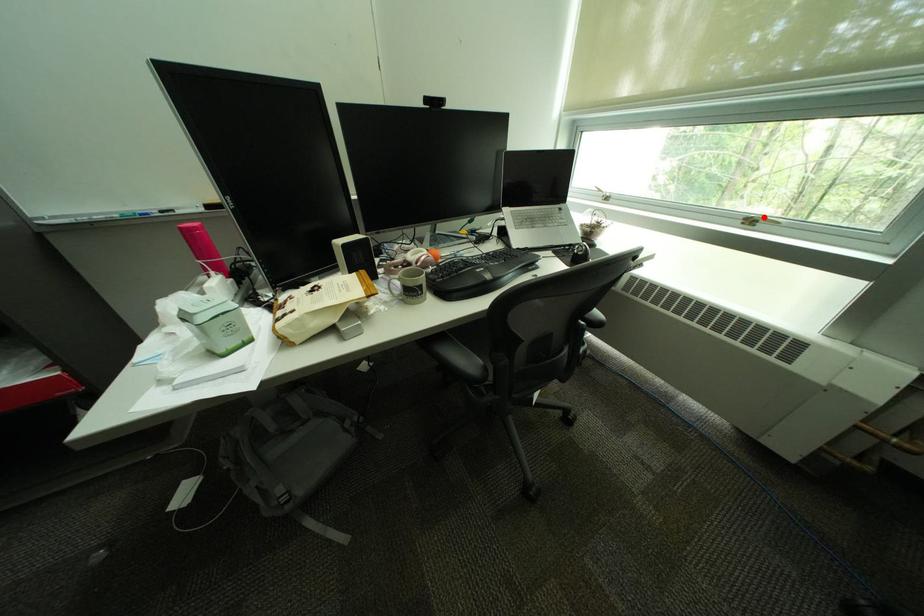
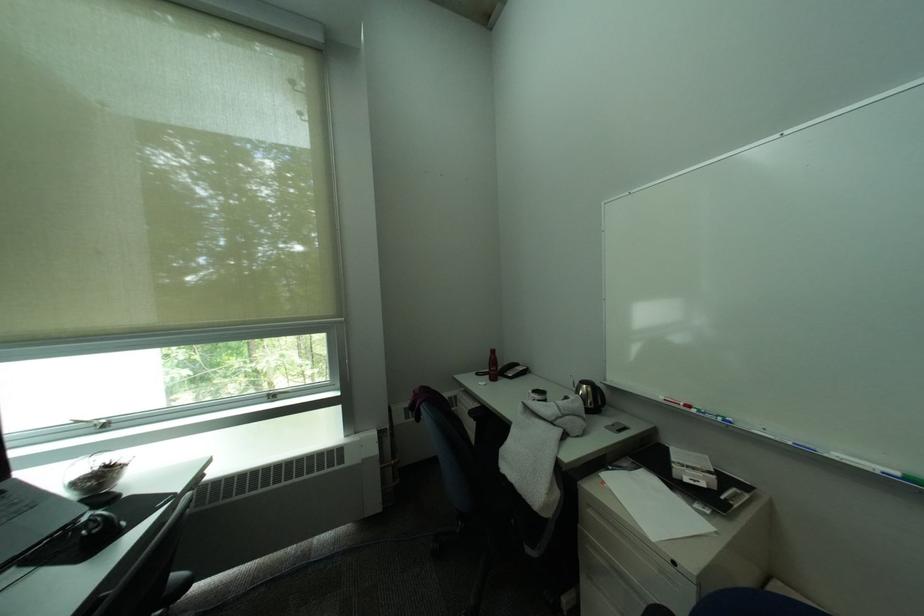
In the second image, find the point that corresponds to the highlighted location in the first image.

(283, 392)